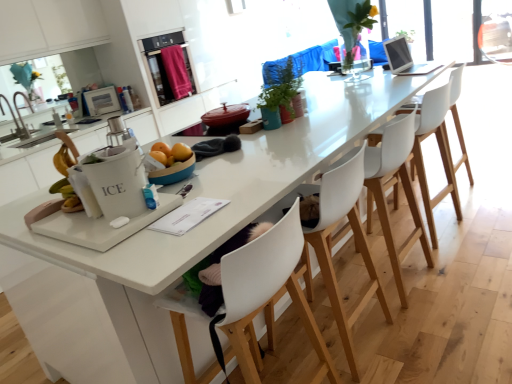
How much space does white glossy microwave at upper left, which appears as the 1th appliance when viewed from the left, occupy horizontally?

The width of white glossy microwave at upper left, which appears as the 1th appliance when viewed from the left, is 2.57 inches.

What do you see at coordinates (280, 94) in the screenshot? I see `green matte plant at center` at bounding box center [280, 94].

What do you see at coordinates (355, 244) in the screenshot? This screenshot has height=384, width=512. I see `white plastic chair at center, which appears as the second chair when viewed from the front` at bounding box center [355, 244].

You are a GUI agent. You are given a task and a screenshot of the screen. Output one action in this format:
    pyautogui.click(x=<x>, y=<y>)
    Task: Click on the white glossy microwave at upper left, placed as the 3th appliance when sorted from front to back
    The width and height of the screenshot is (512, 384).
    Given the screenshot: What is the action you would take?
    pyautogui.click(x=102, y=101)

Considering the sizes of objects white plastic chair at center, the fifth chair positioned from the back, and white plastic chair at center, which appears as the fourth chair when viewed from the back, in the image provided, who is smaller, white plastic chair at center, the fifth chair positioned from the back, or white plastic chair at center, which appears as the fourth chair when viewed from the back,?

white plastic chair at center, which appears as the fourth chair when viewed from the back.

Between white plastic chair at center, the fifth chair positioned from the back, and white plastic chair at center, which appears as the second chair when viewed from the front, which one has less height?

white plastic chair at center, the fifth chair positioned from the back.

From the image's perspective, which is below, white plastic chair at center, acting as the first chair starting from the front, or white plastic chair at center, which appears as the second chair when viewed from the front?

white plastic chair at center, acting as the first chair starting from the front, appears lower in the image.

Is point (211, 374) closer or farther from the camera than point (347, 341)?

Point (211, 374) is positioned closer to the camera compared to point (347, 341).

What's the angular difference between white plastic chair at center, the 4th chair viewed from the front, and white plastic chair at center, which appears as the second chair when viewed from the front,'s facing directions?

There is a 4.78-degree angle between the facing directions of white plastic chair at center, the 4th chair viewed from the front, and white plastic chair at center, which appears as the second chair when viewed from the front.

You are a GUI agent. You are given a task and a screenshot of the screen. Output one action in this format:
    pyautogui.click(x=<x>, y=<y>)
    Task: Click on the chair that is the 2nd object to the right of the white plastic chair at center, which appears as the fourth chair when viewed from the back, starting at the anchor
    Image resolution: width=512 pixels, height=384 pixels.
    Given the screenshot: What is the action you would take?
    pyautogui.click(x=439, y=146)

Consider the image. Can you confirm if white plastic chair at center, the 4th chair viewed from the front, is positioned to the right of white plastic chair at center, which appears as the second chair when viewed from the front?

Correct, you'll find white plastic chair at center, the 4th chair viewed from the front, to the right of white plastic chair at center, which appears as the second chair when viewed from the front.

Would you say white plastic chair at center, which is the 2th chair from back to front, is outside white plastic chair at center, which appears as the fourth chair when viewed from the back?

Indeed, white plastic chair at center, which is the 2th chair from back to front, is completely outside white plastic chair at center, which appears as the fourth chair when viewed from the back.

Is white plastic chair at center, which appears as the fourth chair when viewed from the back, completely or partially inside white plastic chair at right, placed as the first chair when sorted from back to front?

No, white plastic chair at right, placed as the first chair when sorted from back to front, does not contain white plastic chair at center, which appears as the fourth chair when viewed from the back.

Is white plastic chair at right, placed as the first chair when sorted from back to front, wider or thinner than white plastic chair at center, which appears as the fourth chair when viewed from the back?

Considering their sizes, white plastic chair at right, placed as the first chair when sorted from back to front, looks broader than white plastic chair at center, which appears as the fourth chair when viewed from the back.

Based on the photo, which is more to the right, white plastic chair at right, the 5th chair in the front-to-back sequence, or white plastic chair at center, which appears as the second chair when viewed from the front?

white plastic chair at right, the 5th chair in the front-to-back sequence.

Based on their sizes in the image, would you say white plastic chair at right, the 5th chair in the front-to-back sequence, is bigger or smaller than white plastic chair at center, which appears as the fourth chair when viewed from the back?

Considering their sizes, white plastic chair at right, the 5th chair in the front-to-back sequence, takes up more space than white plastic chair at center, which appears as the fourth chair when viewed from the back.

Is white plastic chair at center, positioned as the 3th chair in front-to-back order, aimed at brushed metal faucet at left?

Yes, white plastic chair at center, positioned as the 3th chair in front-to-back order, is turned towards brushed metal faucet at left.

Where is `faucet behind the white plastic chair at center, positioned as the 3th chair in front-to-back order`? faucet behind the white plastic chair at center, positioned as the 3th chair in front-to-back order is located at coordinates (17, 121).

Between white plastic chair at center, which is the 3th chair from back to front, and brushed metal faucet at left, which one is positioned behind?

brushed metal faucet at left is behind.

Considering the sizes of white plastic chair at right, placed as the first chair when sorted from back to front, and white plastic chair at center, the 4th chair viewed from the front, in the image, is white plastic chair at right, placed as the first chair when sorted from back to front, bigger or smaller than white plastic chair at center, the 4th chair viewed from the front,?

In the image, white plastic chair at right, placed as the first chair when sorted from back to front, appears to be larger than white plastic chair at center, the 4th chair viewed from the front.

Would you consider white plastic chair at right, placed as the first chair when sorted from back to front, to be distant from white plastic chair at center, the 4th chair viewed from the front?

No, there isn't a large distance between white plastic chair at right, placed as the first chair when sorted from back to front, and white plastic chair at center, the 4th chair viewed from the front.

From a real-world perspective, is white plastic chair at right, placed as the first chair when sorted from back to front, beneath white plastic chair at center, which is the 2th chair from back to front?

Yes, from a real-world perspective, white plastic chair at right, placed as the first chair when sorted from back to front, is beneath white plastic chair at center, which is the 2th chair from back to front.

How different are the orientations of silver metallic laptop at upper right, the second appliance positioned from the front, and white plastic chair at center, which appears as the fourth chair when viewed from the back, in degrees?

There is a 175-degree angle between the facing directions of silver metallic laptop at upper right, the second appliance positioned from the front, and white plastic chair at center, which appears as the fourth chair when viewed from the back.

Can white plastic chair at center, which appears as the fourth chair when viewed from the back, be found inside silver metallic laptop at upper right, which ranks as the 1th appliance in top-to-bottom order?

Actually, white plastic chair at center, which appears as the fourth chair when viewed from the back, is outside silver metallic laptop at upper right, which ranks as the 1th appliance in top-to-bottom order.

Who is smaller, silver metallic laptop at upper right, which is counted as the 2th appliance, starting from the back, or white plastic chair at center, which appears as the fourth chair when viewed from the back?

silver metallic laptop at upper right, which is counted as the 2th appliance, starting from the back, is smaller.

Is silver metallic laptop at upper right, marked as the 3th appliance in a left-to-right arrangement, wider or thinner than white plastic chair at center, which appears as the second chair when viewed from the front?

Considering their sizes, silver metallic laptop at upper right, marked as the 3th appliance in a left-to-right arrangement, looks slimmer than white plastic chair at center, which appears as the second chair when viewed from the front.

Consider the image. Considering the sizes of white plastic chair at center, positioned as the 3th chair in front-to-back order, and white plastic chair at center, the 4th chair viewed from the front, in the image, is white plastic chair at center, positioned as the 3th chair in front-to-back order, bigger or smaller than white plastic chair at center, the 4th chair viewed from the front,?

In the image, white plastic chair at center, positioned as the 3th chair in front-to-back order, appears to be larger than white plastic chair at center, the 4th chair viewed from the front.

The width and height of the screenshot is (512, 384). I want to click on chair that is the 1st object located below the white plastic chair at center, the 4th chair viewed from the front (from the image's perspective), so click(394, 191).

From a real-world perspective, does white plastic chair at center, positioned as the 3th chair in front-to-back order, stand above white plastic chair at center, the 4th chair viewed from the front?

Yes, from a real-world perspective, white plastic chair at center, positioned as the 3th chair in front-to-back order, is over white plastic chair at center, the 4th chair viewed from the front

Is white plastic chair at center, positioned as the 3th chair in front-to-back order, oriented away from white plastic chair at center, which is the 2th chair from back to front?

No, white plastic chair at center, positioned as the 3th chair in front-to-back order, is not facing away from white plastic chair at center, which is the 2th chair from back to front.

Which chair is the 1st one when counting from the back of the white plastic chair at center, the fifth chair positioned from the back? Please provide its 2D coordinates.

[(355, 244)]

You are a GUI agent. You are given a task and a screenshot of the screen. Output one action in this format:
    pyautogui.click(x=<x>, y=<y>)
    Task: Click on the 2nd chair positioned above the white plastic chair at center, which appears as the second chair when viewed from the front (from the image's perspective)
    
    Given the screenshot: What is the action you would take?
    pyautogui.click(x=439, y=146)

From the image, which object appears to be farther from white plastic chair at right, placed as the first chair when sorted from back to front, white matte ice bucket at center, the third appliance when ordered from back to front, or silver metallic laptop at upper right, which is counted as the 2th appliance, starting from the back?

Among the two, white matte ice bucket at center, the third appliance when ordered from back to front, is located further to white plastic chair at right, placed as the first chair when sorted from back to front.

From the image, which object appears to be nearer to white plastic chair at center, the fifth chair positioned from the back, white plastic chair at center, the 4th chair viewed from the front, or white plastic chair at right, the 5th chair in the front-to-back sequence?

white plastic chair at center, the 4th chair viewed from the front, is closer to white plastic chair at center, the fifth chair positioned from the back.

From the image, which object appears to be farther from white plastic chair at center, the 4th chair viewed from the front, white plastic chair at center, which appears as the fourth chair when viewed from the back, or green matte plant at center?

green matte plant at center lies further to white plastic chair at center, the 4th chair viewed from the front, than the other object.

From the image, which object appears to be farther from silver metallic laptop at upper right, the second appliance positioned from the front, white plastic chair at center, the 4th chair viewed from the front, or white glossy microwave at upper left, placed as the 1th appliance when sorted from back to front?

white glossy microwave at upper left, placed as the 1th appliance when sorted from back to front, is further to silver metallic laptop at upper right, the second appliance positioned from the front.

From the image, which object appears to be nearer to white glossy microwave at upper left, which appears as the 1th appliance when viewed from the left, green matte plant at center or brushed metal faucet at left?

Based on the image, brushed metal faucet at left appears to be nearer to white glossy microwave at upper left, which appears as the 1th appliance when viewed from the left.

From the image, which object appears to be nearer to brushed metal faucet at left, white plastic chair at center, which is the 3th chair from back to front, or white glossy microwave at upper left, placed as the 1th appliance when sorted from back to front?

Among the two, white glossy microwave at upper left, placed as the 1th appliance when sorted from back to front, is located nearer to brushed metal faucet at left.

Based on their spatial positions, is white plastic chair at center, which is the 2th chair from back to front, or white plastic chair at right, placed as the first chair when sorted from back to front, further from brushed metal faucet at left?

The object further to brushed metal faucet at left is white plastic chair at right, placed as the first chair when sorted from back to front.

From the image, which object appears to be nearer to green matte plant at center, white plastic chair at right, placed as the first chair when sorted from back to front, or white matte ice bucket at center, the first appliance positioned from the bottom?

white matte ice bucket at center, the first appliance positioned from the bottom, lies closer to green matte plant at center than the other object.

Find the location of a particular element. chair between white plastic chair at center, which appears as the second chair when viewed from the front, and white plastic chair at center, which is the 2th chair from back to front, in the front-back direction is located at coordinates (394, 191).

You are a GUI agent. You are given a task and a screenshot of the screen. Output one action in this format:
    pyautogui.click(x=<x>, y=<y>)
    Task: Click on the appliance between white plastic chair at center, acting as the first chair starting from the front, and green matte plant at center in the front-back direction
    
    Given the screenshot: What is the action you would take?
    pyautogui.click(x=118, y=180)

The image size is (512, 384). Identify the location of houseplant between white matte ice bucket at center, which is the first appliance from front to back, and white plastic chair at right, placed as the first chair when sorted from back to front. (280, 94).

At what (x,y) coordinates should I click in order to perform the action: click on houseplant located between white glossy microwave at upper left, placed as the 1th appliance when sorted from back to front, and silver metallic laptop at upper right, placed as the 1th appliance when sorted from right to left, in the left-right direction. Please return your answer as a coordinate pair (x, y). The image size is (512, 384). Looking at the image, I should click on (280, 94).